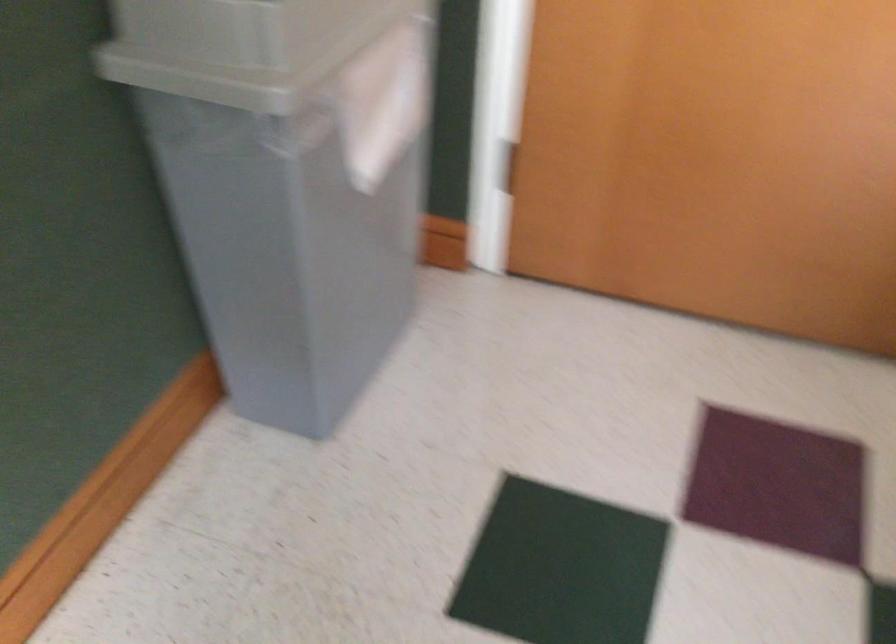
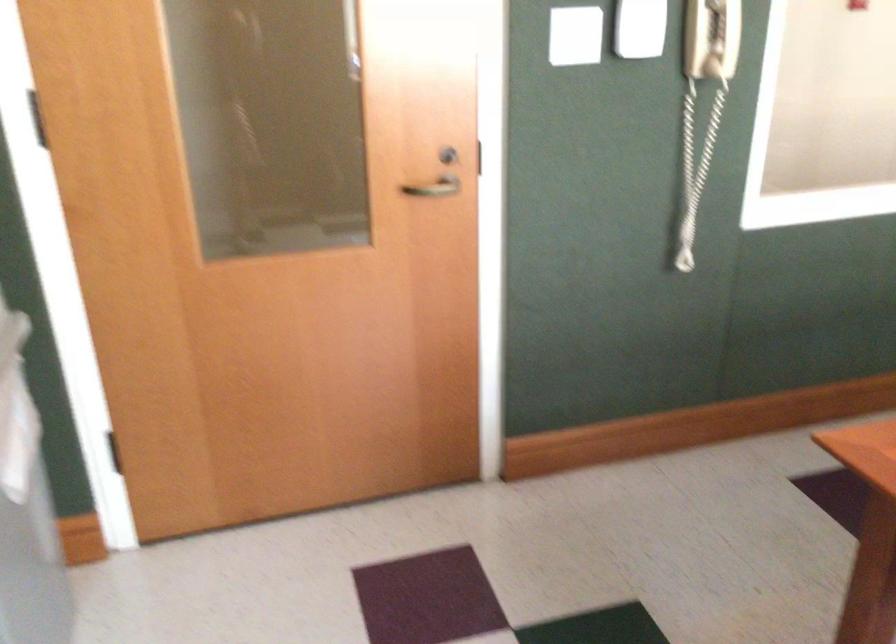
Question: The first image is from the beginning of the video and the second image is from the end. How did the camera likely rotate when shooting the video?

Choices:
 (A) Left
 (B) Right
 (C) Up
 (D) Down

Answer: (B)